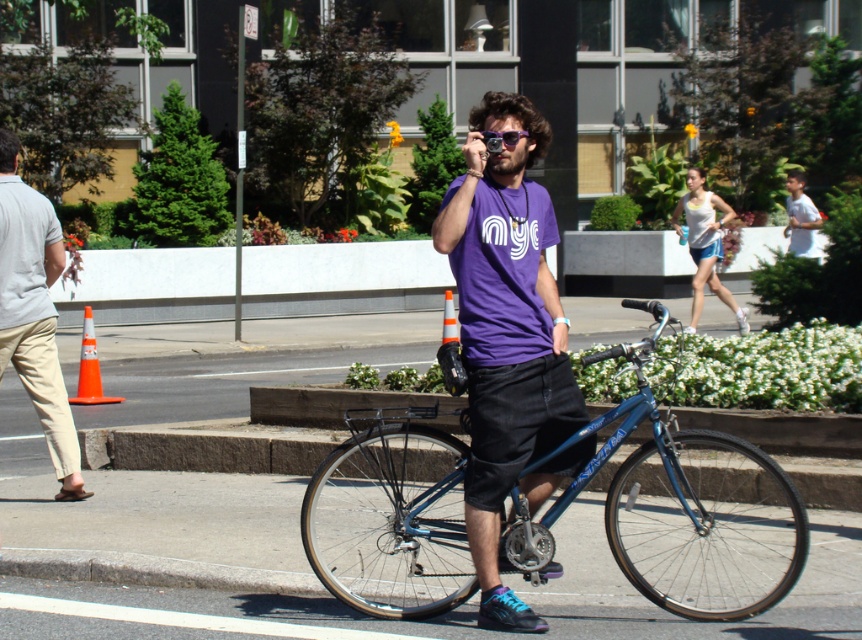
From the picture: Can you confirm if purple matte t-shirt at center is positioned to the right of white cotton shirt at upper right?

No, purple matte t-shirt at center is not to the right of white cotton shirt at upper right.

Based on the photo, between purple matte t-shirt at center and white cotton shirt at upper right, which one has less height?

With less height is purple matte t-shirt at center.

Who is more distant from viewer, (494,108) or (804,220)?

The point (804,220) is behind.

Image resolution: width=862 pixels, height=640 pixels. I want to click on purple matte t-shirt at center, so click(504, 332).

Is point (792, 225) behind point (442, 328)?

Yes.

Is white cotton shirt at upper right thinner than orange plastic traffic cone at center?

In fact, white cotton shirt at upper right might be wider than orange plastic traffic cone at center.

Is point (800, 221) positioned after point (450, 337)?

Yes.

The height and width of the screenshot is (640, 862). I want to click on white cotton shirt at upper right, so (x=801, y=220).

Does orange traffic cone at left have a greater width compared to orange plastic traffic cone at center?

Correct, the width of orange traffic cone at left exceeds that of orange plastic traffic cone at center.

Which is in front, point (101, 387) or point (444, 336)?

Point (101, 387)

Is point (80, 403) positioned before point (457, 328)?

Yes.

The width and height of the screenshot is (862, 640). What are the coordinates of `orange traffic cone at left` in the screenshot? It's located at (89, 368).